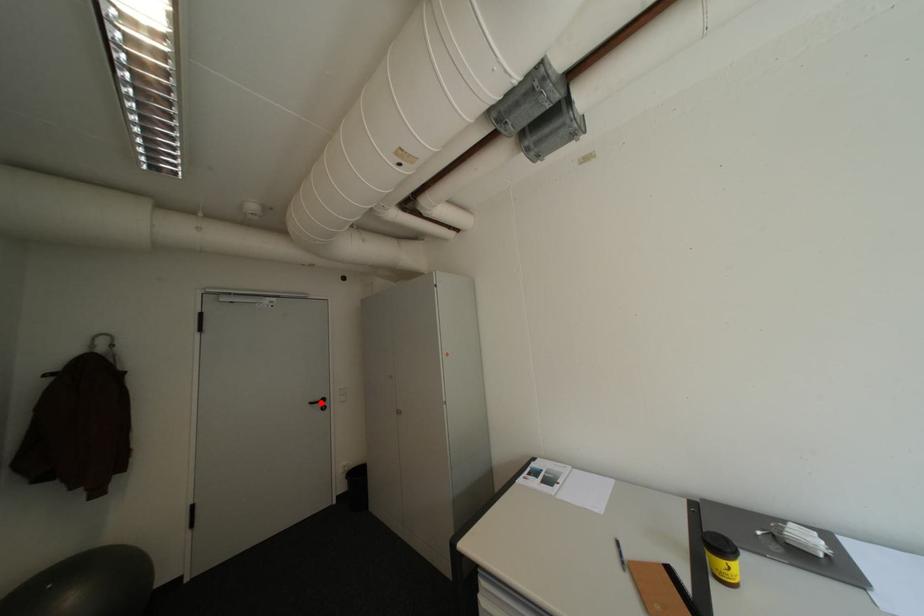
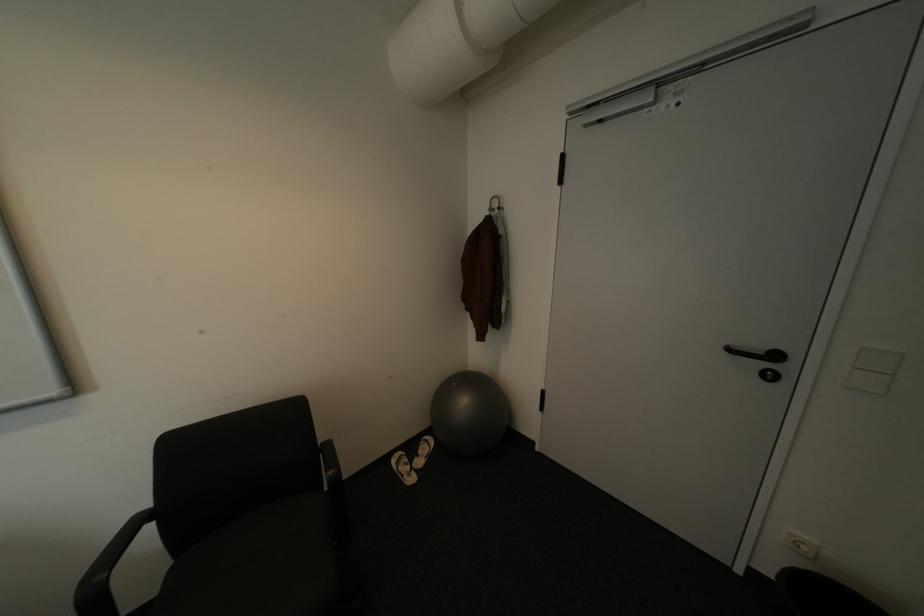
Where in the second image is the point corresponding to the highlighted location from the first image?

(739, 350)